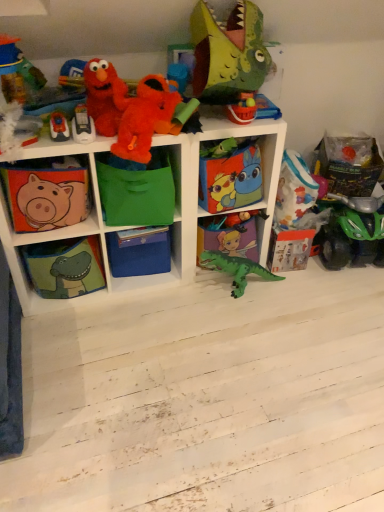
Question: From their relative heights in the image, would you say orange plush toy at upper center, marked as the 2th toy in a top-to-bottom arrangement, is taller or shorter than green plastic dinosaur at center, which ranks as the 1th toy in bottom-to-top order?

Choices:
 (A) tall
 (B) short

Answer: (B)

Question: From a real-world perspective, is orange plush toy at upper center, marked as the 2th toy in a top-to-bottom arrangement, above or below green plastic dinosaur at center, which ranks as the 1th toy in bottom-to-top order?

Choices:
 (A) above
 (B) below

Answer: (A)

Question: Which object is positioned farthest from the green fabric dinosaur at lower left, the fourth shelf positioned from the right?

Choices:
 (A) green fabric bag at center, the 4th shelf when ordered from left to right
 (B) matte green dinosaur head at upper center, positioned as the 1th toy in top-to-bottom order
 (C) fluffy plush at upper left, which ranks as the 5th toy in bottom-to-top order
 (D) cartoon-patterned fabric box at center, arranged as the first box when viewed from the top
 (E) green plastic dinosaur at center, placed as the seventh toy when sorted from top to bottom

Answer: (B)

Question: Which of these objects is positioned closest to the green fabric storage cubes at center, which is counted as the 3th shelf, starting from the right?

Choices:
 (A) plastic matte car at upper left, which is counted as the fifth toy, starting from the top
 (B) cartoon-patterned fabric box at center, which is the 2th box from left to right
 (C) green plastic dinosaur at center, which ranks as the 1th toy in bottom-to-top order
 (D) green fabric bag at center, which ranks as the 2th shelf in right-to-left order
 (E) matte fabric piggy bank at left, the fifth shelf viewed from the right

Answer: (D)